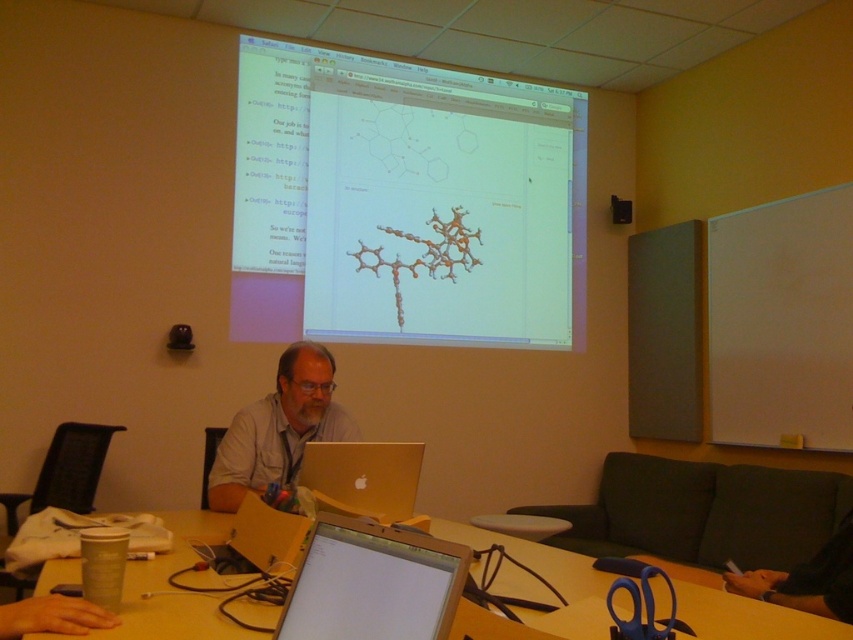
You are a student sitting at the back of the classroom. You notice the gold metallic laptop at center and the translucent plastic screen at upper center. Which object is closer to you?

The translucent plastic screen at upper center is closer to you because the gold metallic laptop at center is behind it.

You are a student in the classroom and need to place a 12 inch ruler between the wooden table at lower center and the gold metallic laptop at center. Will the ruler fit in the space between them?

The wooden table at lower center is 15.64 inches from the gold metallic laptop at center. Since the ruler is 12 inches long, it will fit in the space between them as 12 inches is shorter than 15.64 inches.

You are a student in the classroom and need to place a textbook on the wooden table at lower center. Considering the height of the gold metallic laptop at center, will the textbook be visible once placed?

The wooden table at lower center is shorter than the gold metallic laptop at center, so placing the textbook on the table may result in it being partially or fully obscured by the laptop.